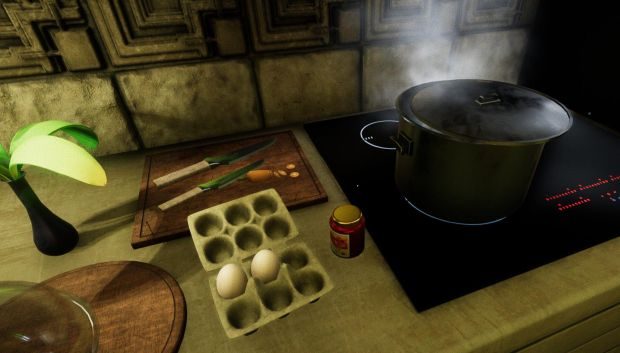
At what (x,y) coordinates should I click in order to perform the action: click on black stock pot. Please return your answer as a coordinate pair (x, y). The width and height of the screenshot is (620, 353). Looking at the image, I should click on pyautogui.click(x=484, y=187).